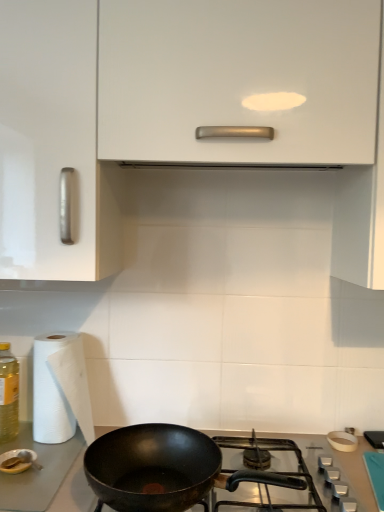
Question: Considering the relative positions of white paper at left and translucent yellow bottle at left in the image provided, is white paper at left to the left of translucent yellow bottle at left from the viewer's perspective?

Choices:
 (A) yes
 (B) no

Answer: (B)

Question: Is white paper at left to the right of translucent yellow bottle at left from the viewer's perspective?

Choices:
 (A) yes
 (B) no

Answer: (A)

Question: Can you confirm if white paper at left is wider than translucent yellow bottle at left?

Choices:
 (A) no
 (B) yes

Answer: (B)

Question: Is white paper at left facing towards translucent yellow bottle at left?

Choices:
 (A) no
 (B) yes

Answer: (A)

Question: Would you say white paper at left is a long distance from translucent yellow bottle at left?

Choices:
 (A) no
 (B) yes

Answer: (A)

Question: Can we say white paper at left lies outside translucent yellow bottle at left?

Choices:
 (A) yes
 (B) no

Answer: (A)

Question: From the image's perspective, does white glossy cabinet at upper center appear lower than white paper at left?

Choices:
 (A) yes
 (B) no

Answer: (B)

Question: From a real-world perspective, is white glossy cabinet at upper center physically below white paper at left?

Choices:
 (A) no
 (B) yes

Answer: (A)

Question: Can you see white glossy cabinet at upper center touching white paper at left?

Choices:
 (A) no
 (B) yes

Answer: (A)

Question: Can you confirm if white glossy cabinet at upper center is shorter than white paper at left?

Choices:
 (A) yes
 (B) no

Answer: (B)

Question: Is white glossy cabinet at upper center taller than white paper at left?

Choices:
 (A) no
 (B) yes

Answer: (B)

Question: Is white glossy cabinet at upper center positioned in front of white paper at left?

Choices:
 (A) yes
 (B) no

Answer: (A)

Question: Is black matte pan at lower center at the left side of white paper at left?

Choices:
 (A) yes
 (B) no

Answer: (B)